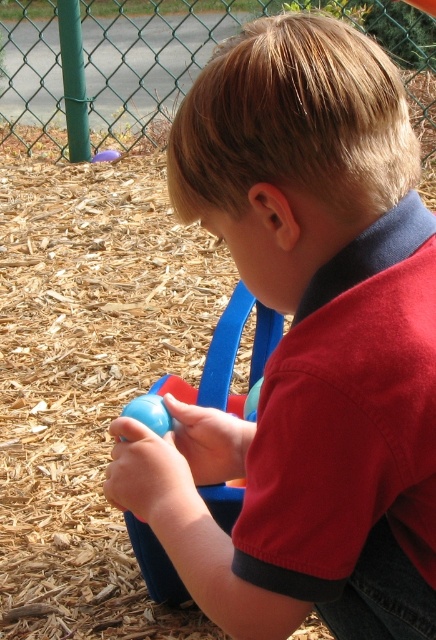
Does matte plastic ball at center appear under matte blue ball at lower center?

Correct, matte plastic ball at center is located below matte blue ball at lower center.

Can you confirm if matte plastic ball at center is thinner than matte blue ball at lower center?

No.

At what (x,y) coordinates should I click in order to perform the action: click on matte plastic ball at center. Please return your answer as a coordinate pair (x, y). The height and width of the screenshot is (640, 436). Looking at the image, I should click on (228, 356).

Image resolution: width=436 pixels, height=640 pixels. I want to click on matte plastic ball at center, so click(228, 356).